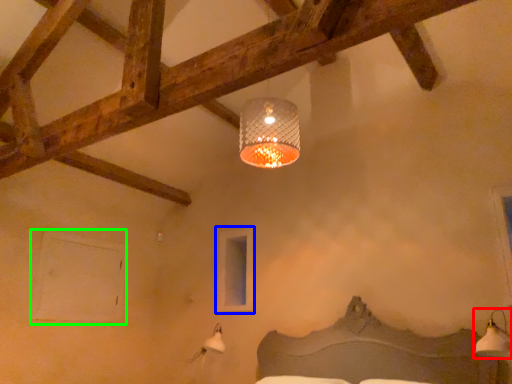
Question: Which object is the farthest from lamp (highlighted by a red box)? Choose among these: window (highlighted by a blue box) or window (highlighted by a green box).

Choices:
 (A) window
 (B) window

Answer: (B)